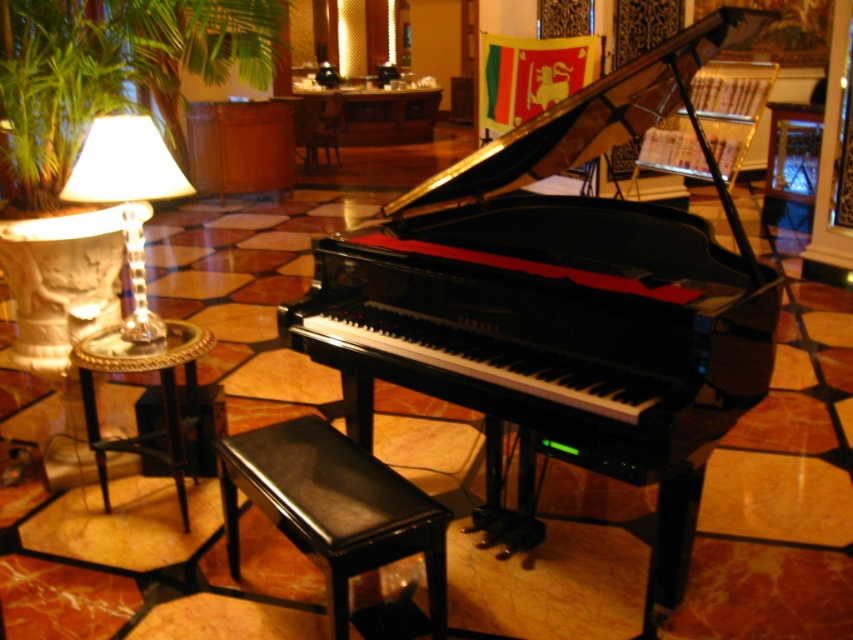
You are standing in the lobby and want to reach the green leafy plant at left and the translucent glass lampshade at left. Which object will you encounter first as you walk towards them?

You will encounter the green leafy plant at left first because it is closer to you than the translucent glass lampshade at left, which is further away.

You are a guest in this lobby and want to sit on the black leather music stool at lower center. To avoid knocking over the translucent glass lampshade at left, should you move towards the stool from the right or the left side?

You should move towards the black leather music stool at lower center from the right side. Since the black leather music stool at lower center is below the translucent glass lampshade at left, approaching from the right side would keep you away from the lampshade and reduce the risk of knocking it over.

You are a guest in this upscale lounge and want to place a small decorative item on the green leafy plant at left or the translucent glass lampshade at left. Which object would be more suitable for placing a small item due to its size?

The green leafy plant at left is larger in size than the translucent glass lampshade at left, so placing a small decorative item on the green leafy plant at left would be more suitable due to its larger surface area.